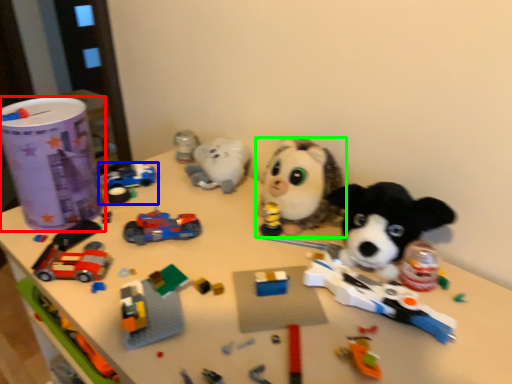
Question: Which is nearer to the toy (highlighted by a red box)? toy (highlighted by a blue box) or toy (highlighted by a green box).

Choices:
 (A) toy
 (B) toy

Answer: (A)